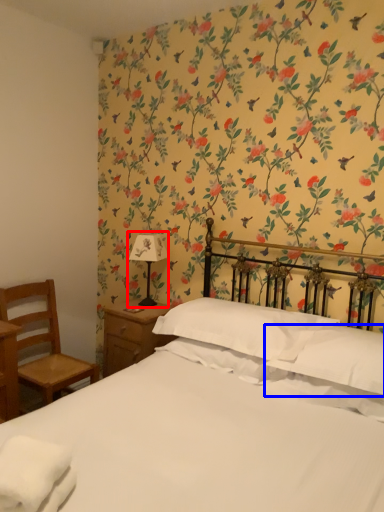
Question: Which object appears closest to the camera in this image, bedside lamp (highlighted by a red box) or pillow (highlighted by a blue box)?

Choices:
 (A) bedside lamp
 (B) pillow

Answer: (B)